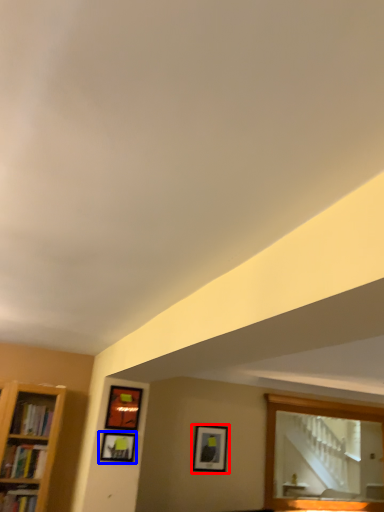
Question: Among these objects, which one is farthest to the camera, picture frame (highlighted by a red box) or picture frame (highlighted by a blue box)?

Choices:
 (A) picture frame
 (B) picture frame

Answer: (A)